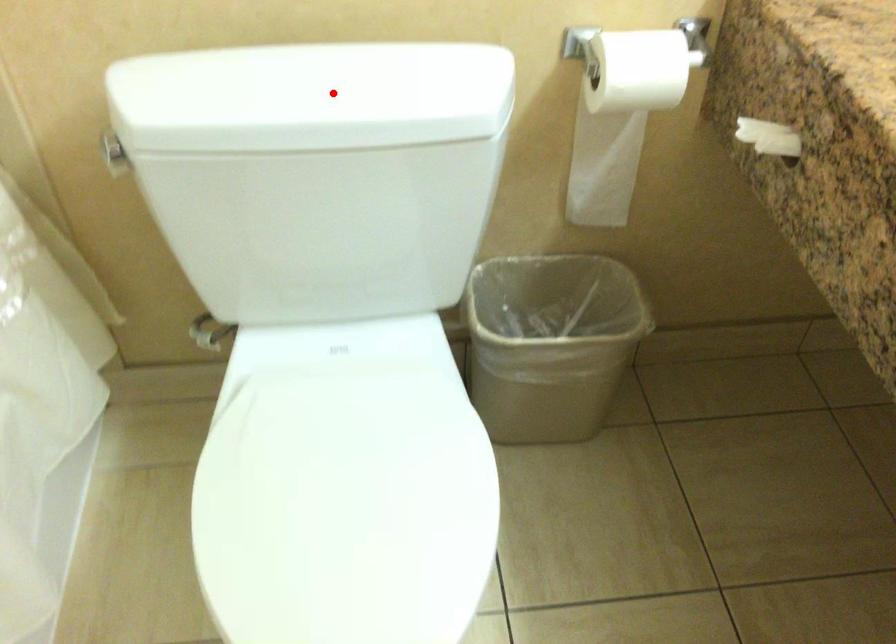
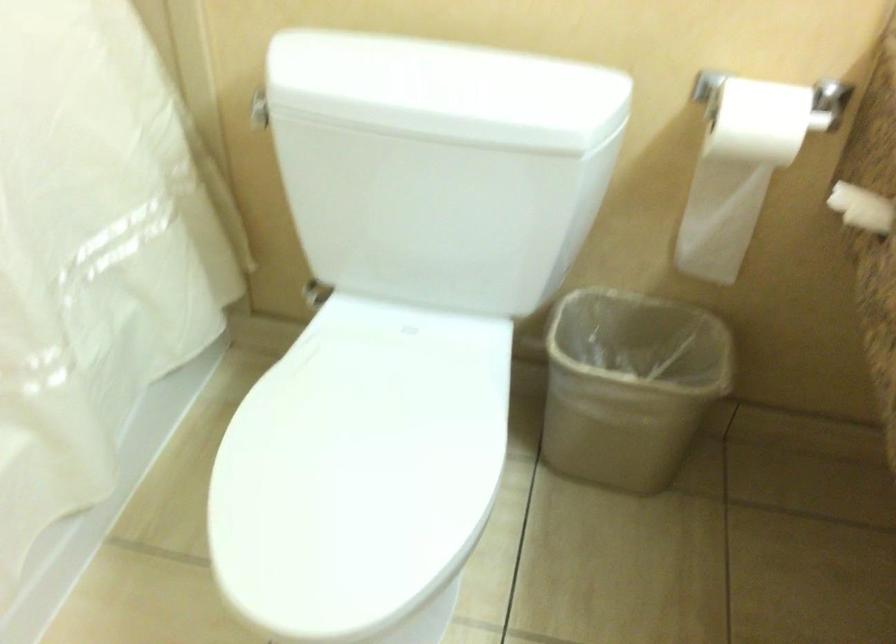
Where in the second image is the point corresponding to the highlighted location from the first image?

(446, 90)